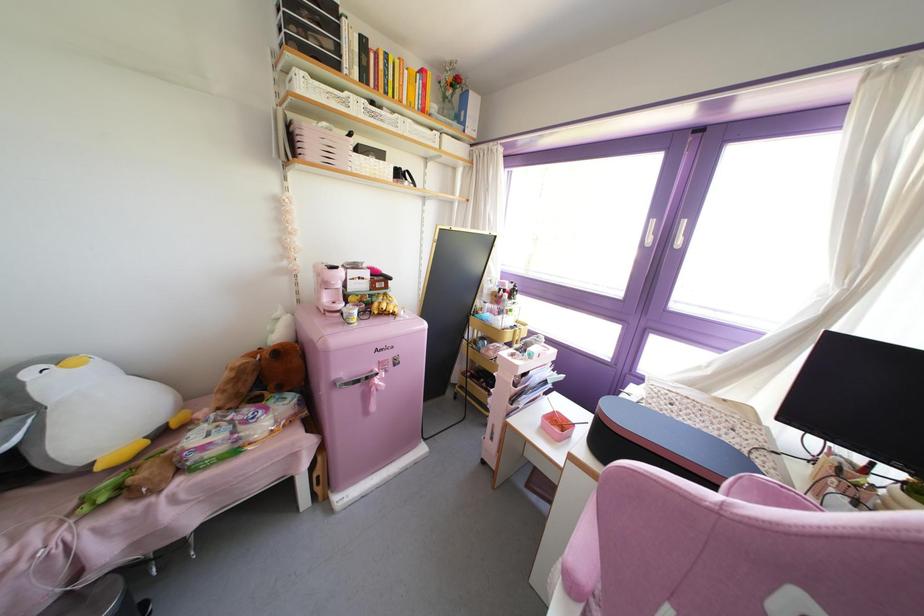
The image size is (924, 616). Describe the element at coordinates (502, 400) in the screenshot. I see `the pink file holder` at that location.